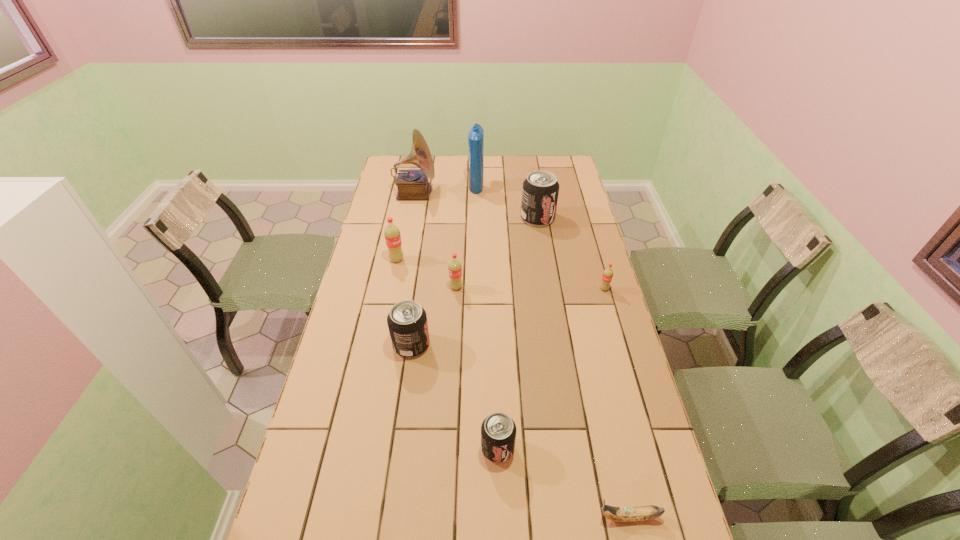
Where is `the smallest red soda`? This screenshot has width=960, height=540. the smallest red soda is located at coordinates [x=607, y=275].

Find the location of a particular element. The width and height of the screenshot is (960, 540). the rightmost object is located at coordinates (607, 275).

This screenshot has width=960, height=540. Find the location of `the smallest black soda can`. the smallest black soda can is located at coordinates (498, 431).

The image size is (960, 540). Identify the location of the third soda can from right to left. (498, 431).

Identify the location of banana. (619, 514).

Find the location of a particular element. the nearest object is located at coordinates (619, 514).

Where is `free spot located 0.400m on the right of the shampoo`? free spot located 0.400m on the right of the shampoo is located at coordinates [569, 184].

The height and width of the screenshot is (540, 960). I want to click on blank area located 0.110m on the horn of the brown phonograph record, so click(x=460, y=193).

Find the location of `blank space located on the front of the rightmost black soda can`. blank space located on the front of the rightmost black soda can is located at coordinates (547, 277).

Identify the location of vacant space located 0.120m on the back of the farthest red soda. (401, 235).